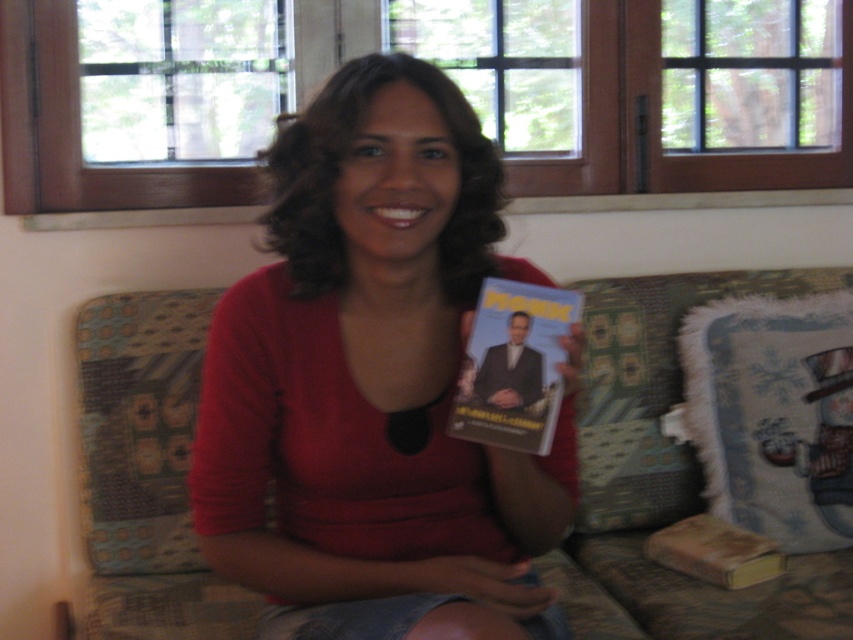
Question: Which of the following is the farthest from the observer?

Choices:
 (A) white fluffy pillow at upper right
 (B) white glossy dvd at center
 (C) brown leather book at lower right
 (D) matte red shirt at center

Answer: (A)

Question: Based on their relative distances, which object is farther from the patterned fabric couch at center?

Choices:
 (A) brown leather book at lower right
 (B) white glossy dvd at center
 (C) white fluffy pillow at upper right

Answer: (B)

Question: Which point is farther to the camera?

Choices:
 (A) (753, 568)
 (B) (763, 484)
 (C) (302, 413)
 (D) (759, 618)

Answer: (B)

Question: Does patterned fabric couch at center appear under brown leather book at lower right?

Choices:
 (A) yes
 (B) no

Answer: (B)

Question: Can you confirm if patterned fabric couch at center is bigger than brown leather book at lower right?

Choices:
 (A) yes
 (B) no

Answer: (A)

Question: Can you confirm if patterned fabric couch at center is positioned to the right of white fluffy pillow at upper right?

Choices:
 (A) yes
 (B) no

Answer: (B)